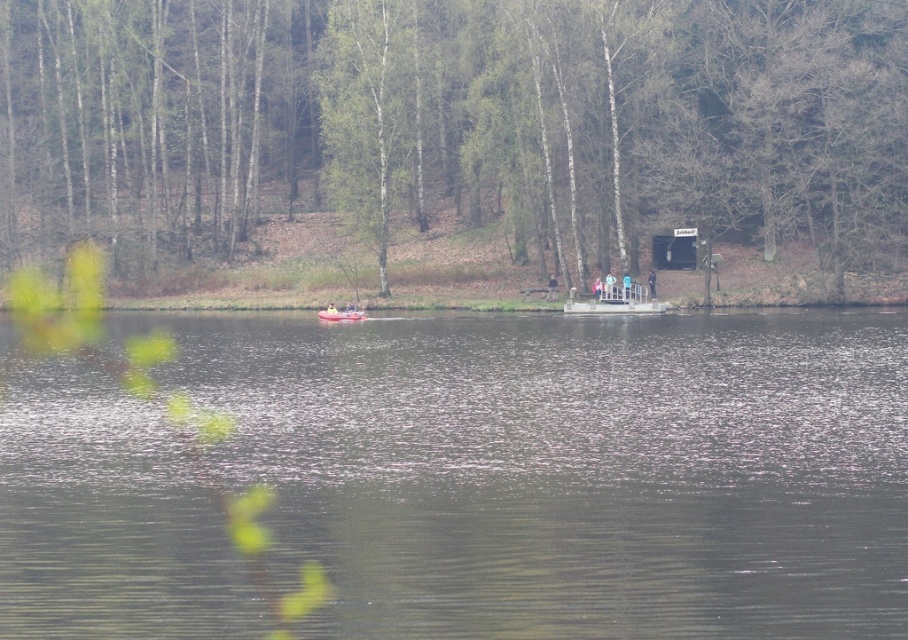
Question: Which point appears farthest from the camera in this image?

Choices:
 (A) (539, 493)
 (B) (334, 314)
 (C) (632, 314)
 (D) (136, 88)

Answer: (D)

Question: Can you confirm if green matte tree at center is positioned above white plastic boat at center?

Choices:
 (A) yes
 (B) no

Answer: (A)

Question: Which point is farther to the camera?

Choices:
 (A) transparent water at center
 (B) white plastic boat at center
 (C) rubber boat at center
 (D) green matte tree at center

Answer: (D)

Question: Is transparent water at center above rubber boat at center?

Choices:
 (A) no
 (B) yes

Answer: (A)

Question: Which of these objects is positioned farthest from the rubber boat at center?

Choices:
 (A) green matte tree at center
 (B) transparent water at center
 (C) white plastic boat at center

Answer: (B)

Question: From the image, what is the correct spatial relationship of white plastic boat at center in relation to rubber boat at center?

Choices:
 (A) left
 (B) right

Answer: (B)